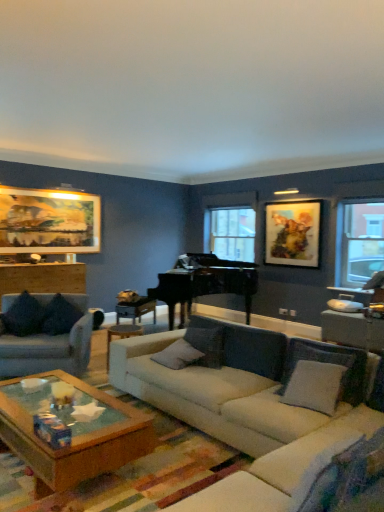
You are a GUI agent. You are given a task and a screenshot of the screen. Output one action in this format:
    pyautogui.click(x=<x>, y=<y>)
    Task: Click on the gold-framed artwork at upper left, marked as the 2th picture frame in a right-to-left arrangement
    
    Given the screenshot: What is the action you would take?
    pyautogui.click(x=49, y=221)

Image resolution: width=384 pixels, height=512 pixels. What do you see at coordinates (50, 347) in the screenshot? I see `dark gray fabric couch at left, the first studio couch when ordered from left to right` at bounding box center [50, 347].

Image resolution: width=384 pixels, height=512 pixels. What do you see at coordinates (230, 225) in the screenshot?
I see `clear glass window at center, which is counted as the second window, starting from the front` at bounding box center [230, 225].

What do you see at coordinates (59, 316) in the screenshot? This screenshot has height=512, width=384. I see `dark fabric pillow at left, which is the 4th pillow in right-to-left order` at bounding box center [59, 316].

At what (x,y) coordinates should I click in order to perform the action: click on velvet dark blue pillow at left, acting as the fifth pillow starting from the right. Please return your answer as a coordinate pair (x, y). This screenshot has width=384, height=512. Looking at the image, I should click on (23, 316).

Looking at this image, which object is further away from the camera taking this photo, oil paint canvas at upper right, which is counted as the 2th picture frame, starting from the left, or gold-framed artwork at upper left, the first picture frame when ordered from left to right?

oil paint canvas at upper right, which is counted as the 2th picture frame, starting from the left, is further away from the camera.

From the image's perspective, between oil paint canvas at upper right, which is counted as the 2th picture frame, starting from the left, and gold-framed artwork at upper left, the first picture frame when ordered from left to right, which one is located above?

gold-framed artwork at upper left, the first picture frame when ordered from left to right, is shown above in the image.

Does oil paint canvas at upper right, acting as the 1th picture frame starting from the right, have a greater height compared to gold-framed artwork at upper left, the first picture frame when ordered from left to right?

In fact, oil paint canvas at upper right, acting as the 1th picture frame starting from the right, may be shorter than gold-framed artwork at upper left, the first picture frame when ordered from left to right.

Is wooden table at right, the second table from the back, situated inside velvet dark blue pillow at left, which is the 1th pillow from left to right, or outside?

The correct answer is: outside.

Image resolution: width=384 pixels, height=512 pixels. In order to click on table on the right of velvet dark blue pillow at left, acting as the fifth pillow starting from the right in this screenshot , I will do `click(353, 330)`.

Is wooden table at right, the second table from the back, not close to velvet dark blue pillow at left, acting as the fifth pillow starting from the right?

Absolutely, wooden table at right, the second table from the back, is distant from velvet dark blue pillow at left, acting as the fifth pillow starting from the right.

Which of these two, wooden table at right, the 1th table when ordered from right to left, or velvet dark blue pillow at left, which is the 1th pillow from left to right, stands shorter?

velvet dark blue pillow at left, which is the 1th pillow from left to right, is shorter.

Which object is wider, oil paint canvas at upper right, acting as the 1th picture frame starting from the right, or velvet dark blue pillow at left, acting as the fifth pillow starting from the right?

velvet dark blue pillow at left, acting as the fifth pillow starting from the right, is wider.

Locate an element on the screen. the 1st pillow below the oil paint canvas at upper right, which is counted as the 2th picture frame, starting from the left (from the image's perspective) is located at coordinates (23, 316).

How far apart are oil paint canvas at upper right, acting as the 1th picture frame starting from the right, and velvet dark blue pillow at left, acting as the fifth pillow starting from the right?

oil paint canvas at upper right, acting as the 1th picture frame starting from the right, is 3.48 meters away from velvet dark blue pillow at left, acting as the fifth pillow starting from the right.

From a real-world perspective, is white fabric couch at center, placed as the first studio couch when sorted from right to left, located higher than wooden table at right, the 1th table when ordered from right to left?

No, from a real-world perspective, white fabric couch at center, placed as the first studio couch when sorted from right to left, is not on top of wooden table at right, the 1th table when ordered from right to left.

Considering the relative sizes of white fabric couch at center, placed as the first studio couch when sorted from right to left, and wooden table at right, the second table from the back, in the image provided, is white fabric couch at center, placed as the first studio couch when sorted from right to left, thinner than wooden table at right, the second table from the back,?

No.

Is white fabric couch at center, the second studio couch viewed from the left, turned away from wooden table at right, the 2th table from the left?

Correct, white fabric couch at center, the second studio couch viewed from the left, is looking away from wooden table at right, the 2th table from the left.

Can we say white fabric couch at center, the second studio couch viewed from the left, lies outside wooden table at right, the 2th table from the left?

That's correct, white fabric couch at center, the second studio couch viewed from the left, is outside of wooden table at right, the 2th table from the left.

Which is farther from the camera, [273,253] or [156,298]?

Point [156,298]

What's the angular difference between oil paint canvas at upper right, acting as the 1th picture frame starting from the right, and black polished piano at center's facing directions?

oil paint canvas at upper right, acting as the 1th picture frame starting from the right, and black polished piano at center are facing 52.4 degrees away from each other.

Considering the relative positions of oil paint canvas at upper right, acting as the 1th picture frame starting from the right, and black polished piano at center in the image provided, is oil paint canvas at upper right, acting as the 1th picture frame starting from the right, behind black polished piano at center?

Yes, it is behind black polished piano at center.

Measure the distance between oil paint canvas at upper right, acting as the 1th picture frame starting from the right, and black polished piano at center.

The distance of oil paint canvas at upper right, acting as the 1th picture frame starting from the right, from black polished piano at center is 1.02 meters.

Does wooden side table at center turn towards oil paint canvas at upper right, which is counted as the 2th picture frame, starting from the left?

No, wooden side table at center is not aimed at oil paint canvas at upper right, which is counted as the 2th picture frame, starting from the left.

From the image's perspective, which is below, wooden side table at center or oil paint canvas at upper right, acting as the 1th picture frame starting from the right?

wooden side table at center, from the image's perspective.

Are wooden side table at center and oil paint canvas at upper right, acting as the 1th picture frame starting from the right, located far from each other?

Indeed, wooden side table at center is not near oil paint canvas at upper right, acting as the 1th picture frame starting from the right.

From a real-world perspective, is black polished piano at center physically above dark fabric pillow at left, which is the 4th pillow in right-to-left order?

Yes.

Is black polished piano at center facing towards dark fabric pillow at left, which appears as the second pillow when viewed from the left?

No, black polished piano at center is not oriented towards dark fabric pillow at left, which appears as the second pillow when viewed from the left.

Considering the positions of point (200, 272) and point (55, 300), is point (200, 272) closer or farther from the camera than point (55, 300)?

Point (200, 272).

I want to click on picture frame behind the gold-framed artwork at upper left, the first picture frame when ordered from left to right, so point(293,234).

Image resolution: width=384 pixels, height=512 pixels. Find the location of `table that appears on the right of velvet dark blue pillow at left, acting as the fifth pillow starting from the right`. table that appears on the right of velvet dark blue pillow at left, acting as the fifth pillow starting from the right is located at coordinates (353, 330).

Considering their positions, is oil paint canvas at upper right, acting as the 1th picture frame starting from the right, positioned further to gray fabric pillow at center, the first pillow viewed from the right, than wooden side table at center?

oil paint canvas at upper right, acting as the 1th picture frame starting from the right.

When comparing their distances from black polished piano at center, does dark fabric pillow at left, which is the 4th pillow in right-to-left order, or wooden side table at center seem closer?

wooden side table at center lies closer to black polished piano at center than the other object.

Consider the image. Looking at the image, which one is located further to gray fabric pillow at center, which is the fourth pillow in left-to-right order, oil paint canvas at upper right, acting as the 1th picture frame starting from the right, or dark gray fabric couch at left, the first studio couch when ordered from left to right?

oil paint canvas at upper right, acting as the 1th picture frame starting from the right, lies further to gray fabric pillow at center, which is the fourth pillow in left-to-right order, than the other object.

Estimate the real-world distances between objects in this image. Which object is closer to wooden side table at center, gray fabric pillow at center, arranged as the second pillow when viewed from the right, or oil paint canvas at upper right, which is counted as the 2th picture frame, starting from the left?

Based on the image, gray fabric pillow at center, arranged as the second pillow when viewed from the right, appears to be nearer to wooden side table at center.

Based on their spatial positions, is dark fabric pillow at left, which is the 4th pillow in right-to-left order, or velvet dark blue pillow at left, which is the 1th pillow from left to right, further from black polished piano at center?

velvet dark blue pillow at left, which is the 1th pillow from left to right, is positioned further to the anchor black polished piano at center.

Estimate the real-world distances between objects in this image. Which object is closer to gray fabric pillow at center, the first pillow viewed from the right, gold-framed artwork at upper left, the first picture frame when ordered from left to right, or white soft pillow at center, which is the third pillow from left to right?

Among the two, white soft pillow at center, which is the third pillow from left to right, is located nearer to gray fabric pillow at center, the first pillow viewed from the right.

From the image, which object appears to be farther from dark fabric pillow at left, which is the 4th pillow in right-to-left order, dark gray fabric couch at left, placed as the second studio couch when sorted from right to left, or wooden table at left, the 1th table from the back?

Among the two, wooden table at left, the 1th table from the back, is located further to dark fabric pillow at left, which is the 4th pillow in right-to-left order.

Which object lies nearer to the anchor point velvet dark blue pillow at left, which is the 1th pillow from left to right, transparent glass window at right, which is the first window in front-to-back order, or oil paint canvas at upper right, which is counted as the 2th picture frame, starting from the left?

oil paint canvas at upper right, which is counted as the 2th picture frame, starting from the left, lies closer to velvet dark blue pillow at left, which is the 1th pillow from left to right, than the other object.

You are a GUI agent. You are given a task and a screenshot of the screen. Output one action in this format:
    pyautogui.click(x=<x>, y=<y>)
    Task: Click on the window located between wooden table at right, the 1th table when ordered from right to left, and clear glass window at center, arranged as the 1th window when viewed from the left, in the depth direction
    This screenshot has height=512, width=384.
    Given the screenshot: What is the action you would take?
    pyautogui.click(x=359, y=241)

The height and width of the screenshot is (512, 384). What are the coordinates of `piano located between velvet dark blue pillow at left, acting as the fifth pillow starting from the right, and oil paint canvas at upper right, acting as the 1th picture frame starting from the right, in the left-right direction` in the screenshot? It's located at (204, 282).

Find the location of a particular element. The width and height of the screenshot is (384, 512). piano between dark gray fabric couch at left, placed as the second studio couch when sorted from right to left, and clear glass window at center, positioned as the second window in right-to-left order, in the front-back direction is located at coordinates (204, 282).

Find the location of a particular element. This screenshot has width=384, height=512. side table positioned between white fabric couch at center, placed as the first studio couch when sorted from right to left, and dark fabric pillow at left, which is the 4th pillow in right-to-left order, from near to far is located at coordinates (121, 335).